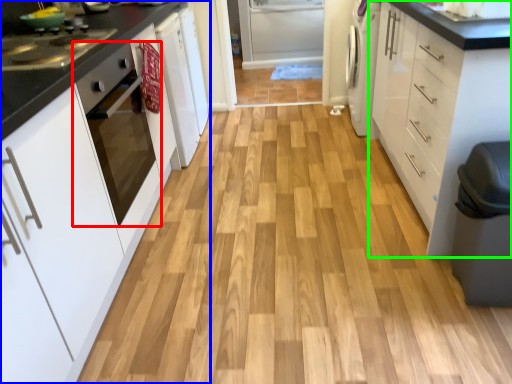
Question: Estimate the real-world distances between objects in this image. Which object is farther from home appliance (highlighted by a red box), cabinetry (highlighted by a blue box) or cabinetry (highlighted by a green box)?

Choices:
 (A) cabinetry
 (B) cabinetry

Answer: (B)